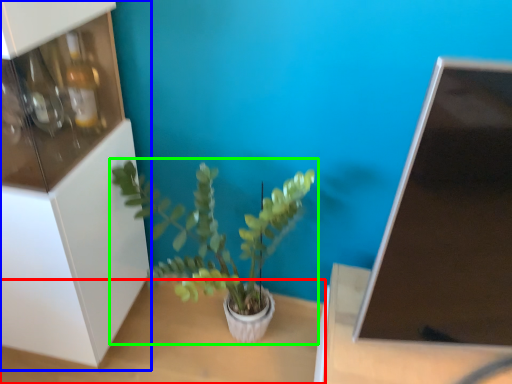
Question: Which object is the closest to the table (highlighted by a red box)? Choose among these: shelf (highlighted by a blue box) or houseplant (highlighted by a green box).

Choices:
 (A) shelf
 (B) houseplant

Answer: (B)